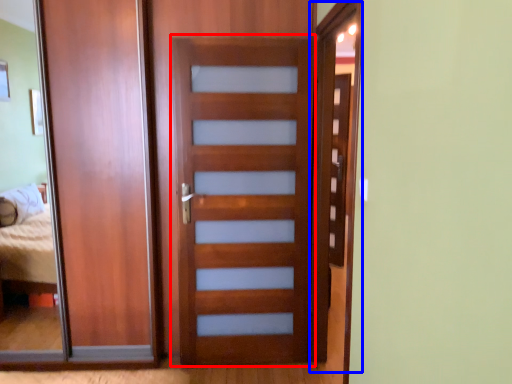
Question: Which object appears farthest to the camera in this image, screen door (highlighted by a red box) or screen door (highlighted by a blue box)?

Choices:
 (A) screen door
 (B) screen door

Answer: (A)